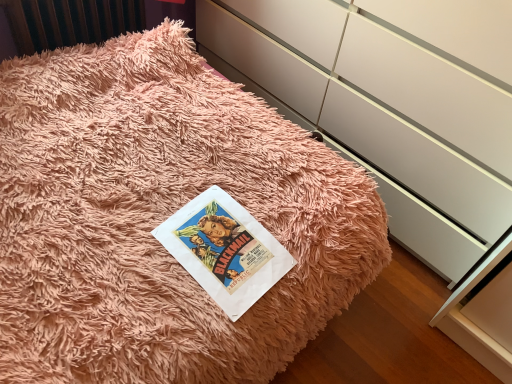
Question: Is point (251, 56) positioned closer to the camera than point (207, 192)?

Choices:
 (A) closer
 (B) farther

Answer: (B)

Question: Would you say white glossy cabinetry at center is inside or outside vintage paper at center?

Choices:
 (A) inside
 (B) outside

Answer: (B)

Question: Is white glossy cabinetry at center in front of or behind vintage paper at center in the image?

Choices:
 (A) behind
 (B) front

Answer: (B)

Question: Considering the positions of point (270, 259) and point (426, 84), is point (270, 259) closer or farther from the camera than point (426, 84)?

Choices:
 (A) closer
 (B) farther

Answer: (A)

Question: In terms of width, does vintage paper at center look wider or thinner when compared to white glossy cabinetry at center?

Choices:
 (A) wide
 (B) thin

Answer: (B)

Question: From the image's perspective, is vintage paper at center above or below white glossy cabinetry at center?

Choices:
 (A) below
 (B) above

Answer: (A)

Question: From a real-world perspective, relative to white glossy cabinetry at center, is vintage paper at center vertically above or below?

Choices:
 (A) above
 (B) below

Answer: (B)